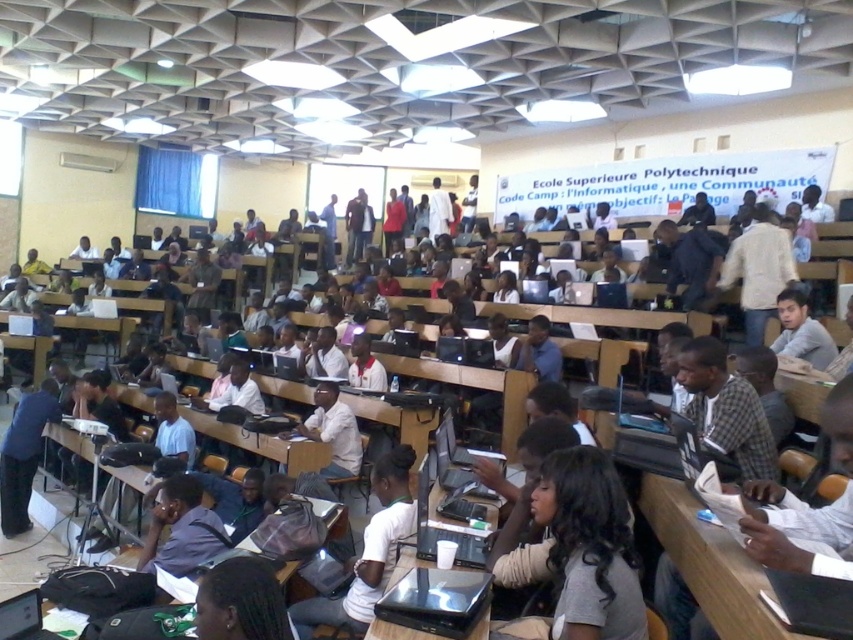
Question: Which object is farther from the camera taking this photo?

Choices:
 (A) dark blue shirt at lower left
 (B) white matte backpack at center
 (C) gray matte shirt at right

Answer: (C)

Question: Considering the relative positions of white matte shirt at center and gray matte shirt at right in the image provided, where is white matte shirt at center located with respect to gray matte shirt at right?

Choices:
 (A) left
 (B) right

Answer: (A)

Question: Which of the following is the farthest from the observer?

Choices:
 (A) white matte backpack at center
 (B) white matte shirt at center
 (C) wooden table at center
 (D) wooden table at lower right

Answer: (B)

Question: Is dark blue shirt at lower left in front of blue fabric shirt at lower left?

Choices:
 (A) no
 (B) yes

Answer: (B)

Question: Estimate the real-world distances between objects in this image. Which object is closer to the gray matte shirt at right?

Choices:
 (A) black hair at lower center
 (B) white matte backpack at center
 (C) dark gray hair at center
 (D) white matte shirt at center

Answer: (B)

Question: Can you confirm if dark gray hair at center is positioned above wooden table at lower right?

Choices:
 (A) no
 (B) yes

Answer: (B)